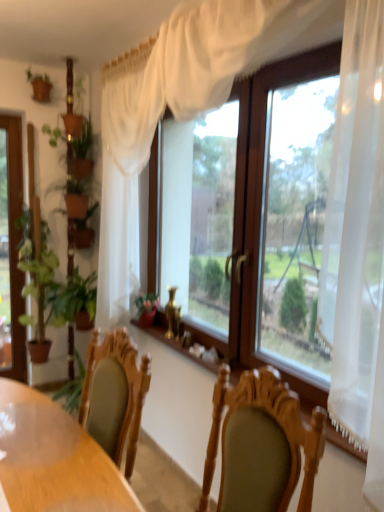
The height and width of the screenshot is (512, 384). What do you see at coordinates (54, 459) in the screenshot?
I see `wooden table at center` at bounding box center [54, 459].

What do you see at coordinates (36, 276) in the screenshot? This screenshot has height=512, width=384. I see `green leafy plant at left` at bounding box center [36, 276].

You are a GUI agent. You are given a task and a screenshot of the screen. Output one action in this format:
    pyautogui.click(x=<x>, y=<y>)
    Task: Click on the wooden table at center
    
    Given the screenshot: What is the action you would take?
    pyautogui.click(x=54, y=459)

Does wooden table at center have a lesser width compared to green leafy plant at left?

No.

Which is behind, wooden table at center or green leafy plant at left?

Positioned behind is green leafy plant at left.

Is wooden table at center oriented towards green leafy plant at left?

No, wooden table at center is not aimed at green leafy plant at left.

What's the angular difference between transparent glass window at center and wooden table at center's facing directions?

8.67 degrees.

Does point (179, 46) lie behind point (42, 425)?

Yes, point (179, 46) is behind point (42, 425).

From a real-world perspective, is transparent glass window at center physically above wooden table at center?

Correct, in the physical world, transparent glass window at center is higher than wooden table at center.

Can you confirm if transparent glass window at center is shorter than wooden table at center?

Incorrect, the height of transparent glass window at center does not fall short of that of wooden table at center.

Does wooden table at center have a greater width compared to transparent glass window at center?

Yes.

How different are the orientations of wooden table at center and transparent glass window at center in degrees?

They differ by 8.67 degrees in their facing directions.

Locate an element on the screen. The width and height of the screenshot is (384, 512). window above the wooden table at center (from the image's perspective) is located at coordinates click(x=183, y=100).

Considering the relative sizes of green leafy plant at left and transparent glass window at center in the image provided, is green leafy plant at left wider than transparent glass window at center?

Yes.

Can you confirm if green leafy plant at left is positioned to the right of transparent glass window at center?

In fact, green leafy plant at left is to the left of transparent glass window at center.

The height and width of the screenshot is (512, 384). What are the coordinates of `window on the right of green leafy plant at left` in the screenshot? It's located at tap(183, 100).

Considering the points (23, 246) and (365, 25), which point is behind, point (23, 246) or point (365, 25)?

The point (23, 246) is farther.

Considering the sizes of objects green leafy plant at left and wooden table at center in the image provided, who is thinner, green leafy plant at left or wooden table at center?

With smaller width is green leafy plant at left.

The image size is (384, 512). Find the location of `houseplant above the wooden table at center (from the image's perspective)`. houseplant above the wooden table at center (from the image's perspective) is located at coordinates (36, 276).

Which is behind, green leafy plant at left or wooden table at center?

Positioned behind is green leafy plant at left.

Does green leafy plant at left have a larger size compared to wooden table at center?

Incorrect, green leafy plant at left is not larger than wooden table at center.

Which object is closer to the camera taking this photo, transparent glass window at center or green leafy plant at left?

transparent glass window at center is in front.

Is transparent glass window at center not close to green leafy plant at left?

Yes, transparent glass window at center is far from green leafy plant at left.

Is point (382, 180) farther from camera compared to point (41, 243)?

No.

From the image's perspective, is transparent glass window at center on green leafy plant at left?

Yes, from the image's perspective, transparent glass window at center is on top of green leafy plant at left.

I want to click on houseplant above the wooden table at center (from a real-world perspective), so click(36, 276).

Find the location of a particular element. This screenshot has height=512, width=384. window located above the wooden table at center (from the image's perspective) is located at coordinates (183, 100).

When comparing their distances from transparent glass window at center, does wooden table at center or green leafy plant at left seem closer?

The object closer to transparent glass window at center is wooden table at center.

Looking at the image, which one is located further to transparent glass window at center, green leafy plant at left or wooden table at center?

Based on the image, green leafy plant at left appears to be further to transparent glass window at center.

Estimate the real-world distances between objects in this image. Which object is closer to green leafy plant at left, wooden table at center or transparent glass window at center?

transparent glass window at center.

Considering their positions, is transparent glass window at center positioned closer to green leafy plant at left than wooden table at center?

transparent glass window at center is positioned closer to the anchor green leafy plant at left.

Looking at the image, which one is located further to wooden table at center, green leafy plant at left or transparent glass window at center?

The object further to wooden table at center is green leafy plant at left.

Considering their positions, is transparent glass window at center positioned further to wooden table at center than green leafy plant at left?

green leafy plant at left is further to wooden table at center.

You are a GUI agent. You are given a task and a screenshot of the screen. Output one action in this format:
    pyautogui.click(x=<x>, y=<y>)
    Task: Click on the table between transparent glass window at center and green leafy plant at left in the front-back direction
    
    Given the screenshot: What is the action you would take?
    pyautogui.click(x=54, y=459)